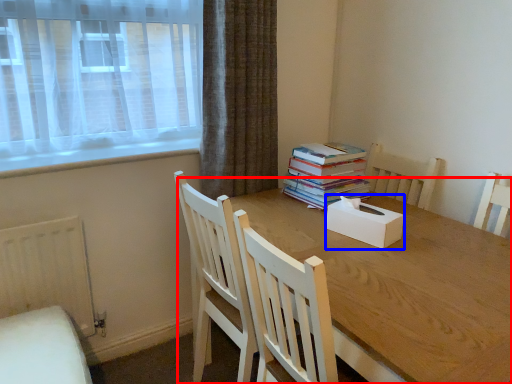
Question: Which point is closer to the camera, round table (highlighted by a red box) or box (highlighted by a blue box)?

Choices:
 (A) round table
 (B) box

Answer: (A)